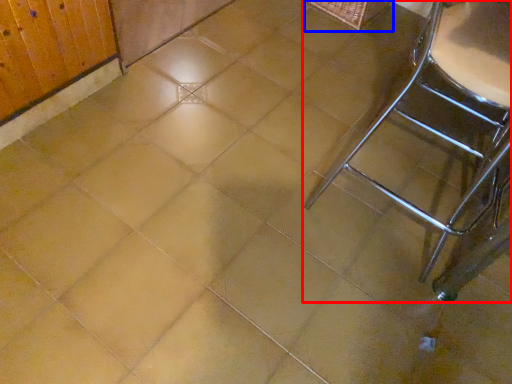
Question: Which object appears farthest to the camera in this image, furniture (highlighted by a red box) or basket (highlighted by a blue box)?

Choices:
 (A) furniture
 (B) basket

Answer: (B)